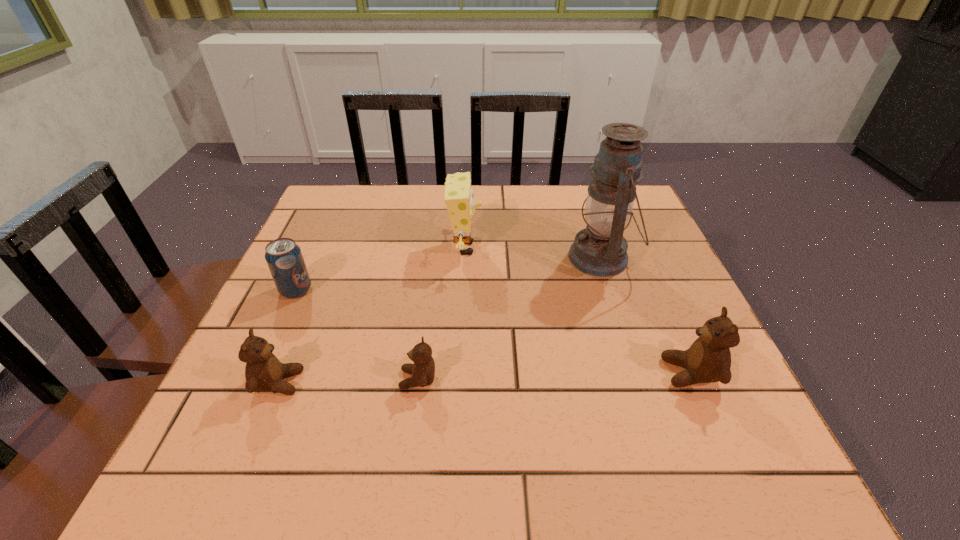
Locate an element on the screen. free space at the far left corner is located at coordinates (342, 206).

The height and width of the screenshot is (540, 960). In the image, there is a desktop. Find the location of `vacant space at the near left corner`. vacant space at the near left corner is located at coordinates (239, 408).

Identify the location of free space at the far right corner of the desktop. (634, 220).

The image size is (960, 540). In the image, there is a desktop. In order to click on vacant space at the near right corner in this screenshot , I will do `click(697, 386)`.

Locate an element on the screen. This screenshot has width=960, height=540. blank region between the rightmost teddy bear and the second teddy bear from left to right is located at coordinates (554, 376).

The image size is (960, 540). I want to click on empty space that is in between the second teddy bear from right to left and the second shortest teddy bear, so click(348, 381).

Find the location of a particular element. Image resolution: width=960 pixels, height=540 pixels. free point between the third object from right to left and the third tallest object is located at coordinates pos(578,310).

At what (x,y) coordinates should I click in order to perform the action: click on vacant point located between the third object from left to right and the oil lamp. Please return your answer as a coordinate pair (x, y). The width and height of the screenshot is (960, 540). Looking at the image, I should click on click(510, 319).

This screenshot has height=540, width=960. Identify the location of vacant region between the oil lamp and the second tallest teddy bear. (440, 320).

Locate an element on the screen. unoccupied position between the tallest teddy bear and the second teddy bear from left to right is located at coordinates (554, 376).